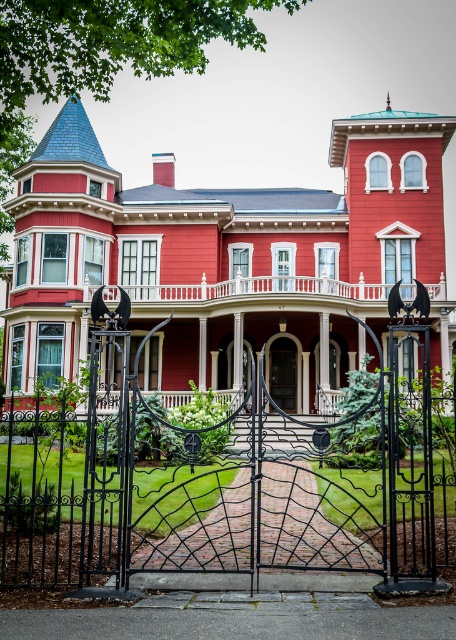
Who is lower down, smooth red porch at center or smooth wood door at center?

smooth wood door at center is below.

In the scene shown: Is smooth red porch at center below smooth wood door at center?

No.

Find the location of a particular element. This screenshot has width=456, height=640. smooth red porch at center is located at coordinates (258, 289).

Identify the location of smooth red porch at center. (258, 289).

Between point (312, 509) and point (271, 381), which one is positioned in front?

Point (312, 509)

From the picture: Who is lower down, black wrought iron gate at center or smooth wood door at center?

smooth wood door at center is below.

This screenshot has height=640, width=456. Describe the element at coordinates (218, 480) in the screenshot. I see `black wrought iron gate at center` at that location.

Find the location of a particular element. The image size is (456, 640). black wrought iron gate at center is located at coordinates (218, 480).

Who is positioned more to the left, black wrought iron gate at center or smooth red porch at center?

From the viewer's perspective, black wrought iron gate at center appears more on the left side.

Is point (74, 440) positioned before point (259, 292)?

Yes, it is in front of point (259, 292).

You are a GUI agent. You are given a task and a screenshot of the screen. Output one action in this format:
    pyautogui.click(x=<x>, y=<y>)
    Task: Click on the black wrought iron gate at center
    Image resolution: width=456 pixels, height=640 pixels.
    Given the screenshot: What is the action you would take?
    pyautogui.click(x=218, y=480)